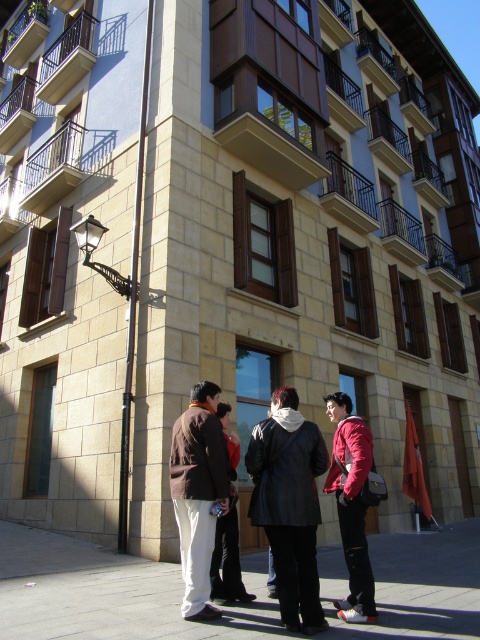
Does leather jacket at center have a larger size compared to matte red jacket at center?

Indeed, leather jacket at center has a larger size compared to matte red jacket at center.

Is leather jacket at center thinner than matte red jacket at center?

No.

This screenshot has width=480, height=640. Find the location of `leather jacket at center`. leather jacket at center is located at coordinates (288, 504).

Can you confirm if matte red jacket at center is positioned to the right of black leather jacket at center?

Correct, you'll find matte red jacket at center to the right of black leather jacket at center.

What do you see at coordinates (351, 504) in the screenshot? I see `matte red jacket at center` at bounding box center [351, 504].

Does point (365, 456) lie behind point (229, 534)?

No, (365, 456) is closer to viewer.

I want to click on matte red jacket at center, so click(351, 504).

Who is shorter, brown leather jacket at center or black leather jacket at center?

black leather jacket at center is shorter.

Can you confirm if brown leather jacket at center is positioned below black leather jacket at center?

Incorrect, brown leather jacket at center is not positioned below black leather jacket at center.

Which is in front, point (191, 483) or point (228, 576)?

Point (191, 483) is in front.

Find the location of a particular element. This screenshot has height=640, width=480. brown leather jacket at center is located at coordinates (197, 493).